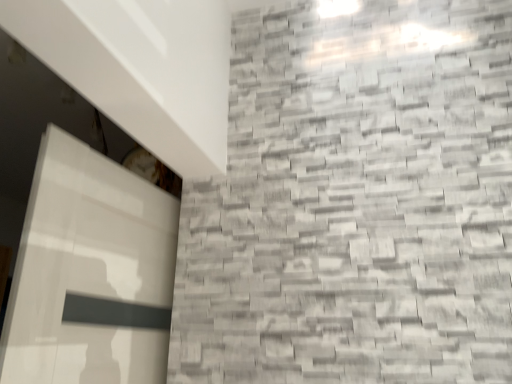
Question: Should I look upward or downward to see white glossy exhaust hood at upper left?

Choices:
 (A) down
 (B) up

Answer: (B)